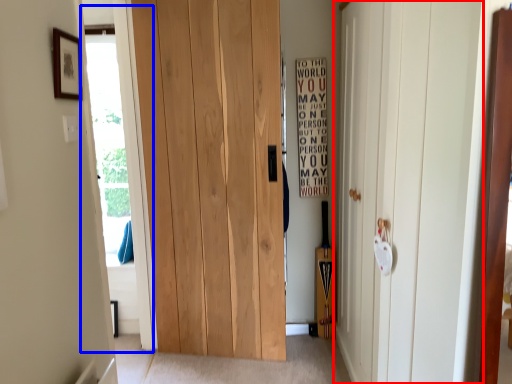
Question: Which object appears closest to the camera in this image, door (highlighted by a red box) or glass door (highlighted by a blue box)?

Choices:
 (A) door
 (B) glass door

Answer: (A)